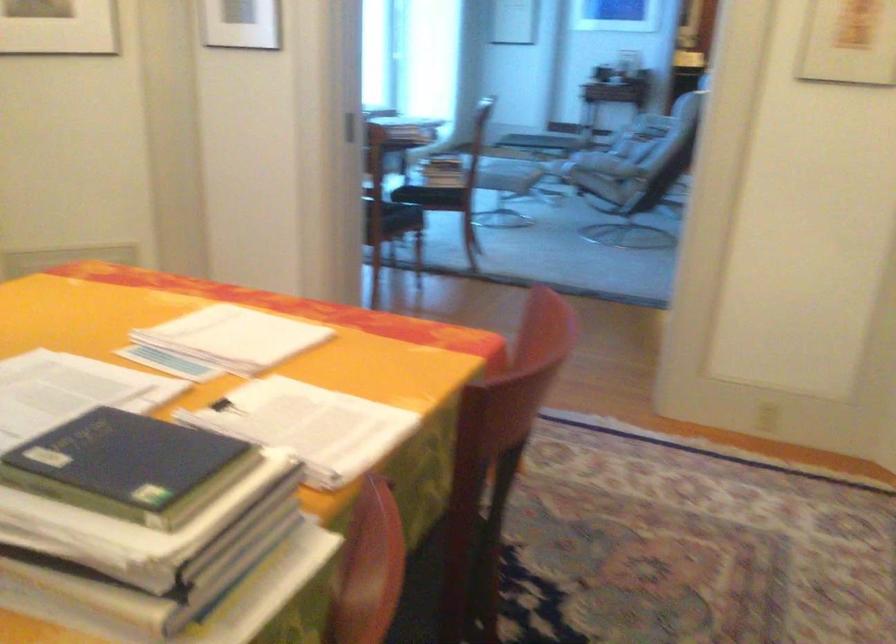
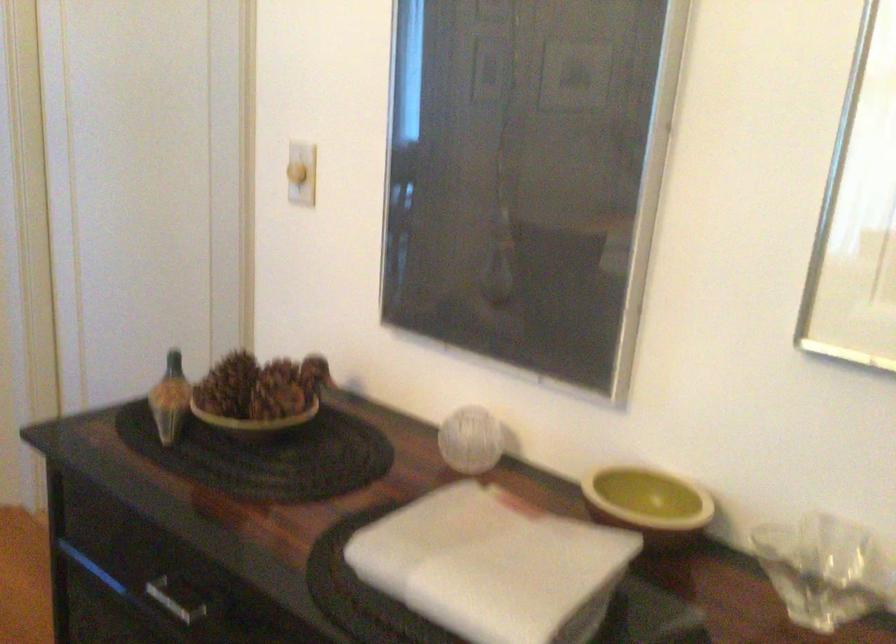
Question: The images are taken continuously from a first-person perspective. In which direction is your viewpoint rotating?

Choices:
 (A) Left
 (B) Right
 (C) Up
 (D) Down

Answer: (B)